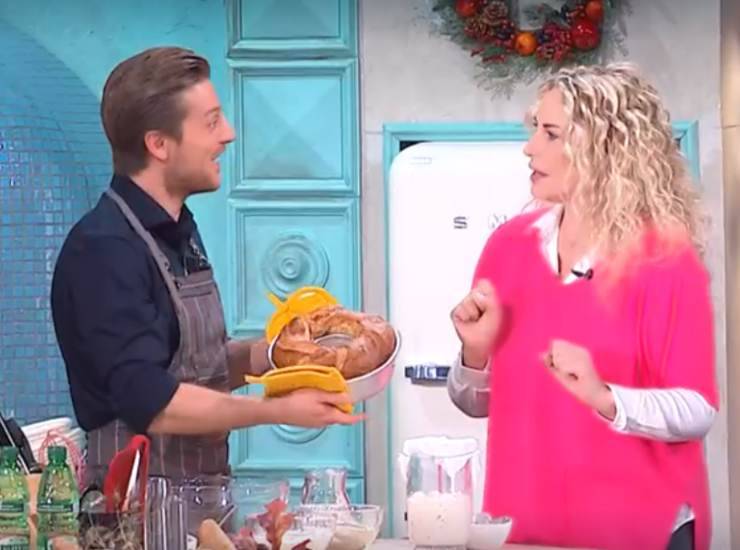
At what (x,y) coordinates should I click in order to perform the action: click on wreath. Please return your answer as a coordinate pair (x, y). Image resolution: width=740 pixels, height=550 pixels. Looking at the image, I should click on (499, 55).